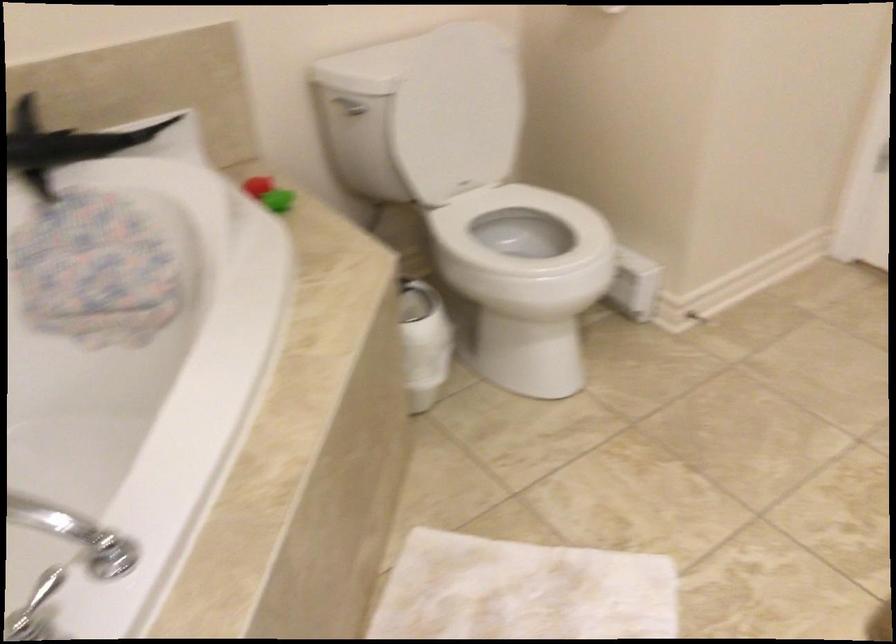
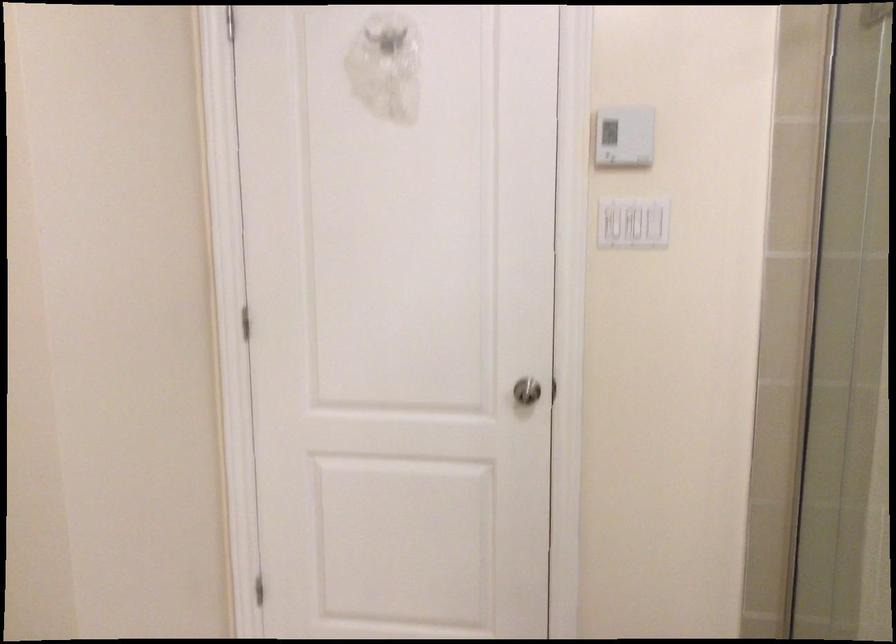
Based on the continuous images, in which direction is the camera rotating?

The camera rotated toward right-up.